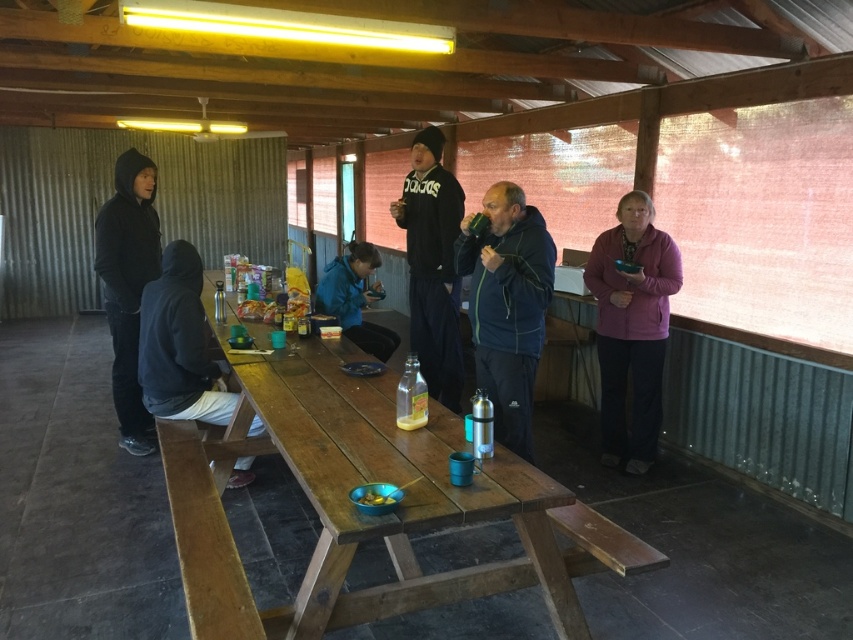
Question: Observing the image, what is the correct spatial positioning of dark blue jacket at center in reference to black fabric jacket at left?

Choices:
 (A) below
 (B) above

Answer: (B)

Question: Observing the image, what is the correct spatial positioning of wooden picnic table at center in reference to black fleece jacket at center?

Choices:
 (A) above
 (B) below

Answer: (B)

Question: Which point is farther to the camera?

Choices:
 (A) (213, 532)
 (B) (653, 262)
 (C) (134, 310)

Answer: (C)

Question: Does dark blue jacket at center appear under black fabric jacket at left?

Choices:
 (A) no
 (B) yes

Answer: (A)

Question: Considering the real-world distances, which object is farthest from the pink fleece jacket at right?

Choices:
 (A) black fabric jacket at left
 (B) black hoodie at left

Answer: (B)

Question: Among these points, which one is farthest from the camera?

Choices:
 (A) (450, 326)
 (B) (410, 577)

Answer: (A)